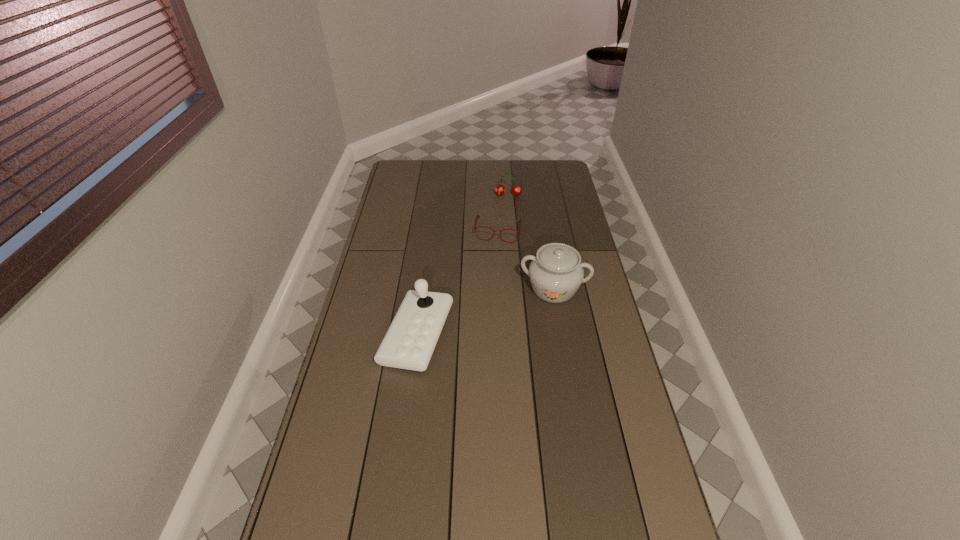
This screenshot has width=960, height=540. I want to click on free location that satisfies the following two spatial constraints: 1. on the front side of the farthest object; 2. on the left side of the chinaware, so click(x=516, y=288).